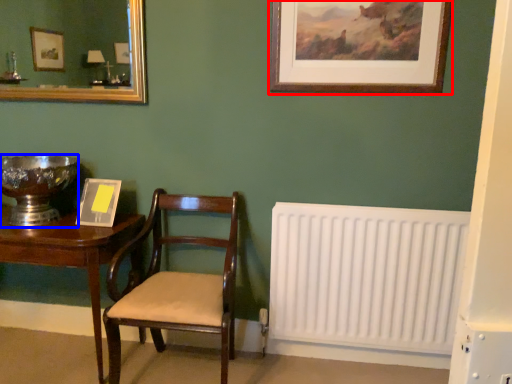
Question: Which of the following is the closest to the observer, picture frame (highlighted by a red box) or glass bowl (highlighted by a blue box)?

Choices:
 (A) picture frame
 (B) glass bowl

Answer: (A)